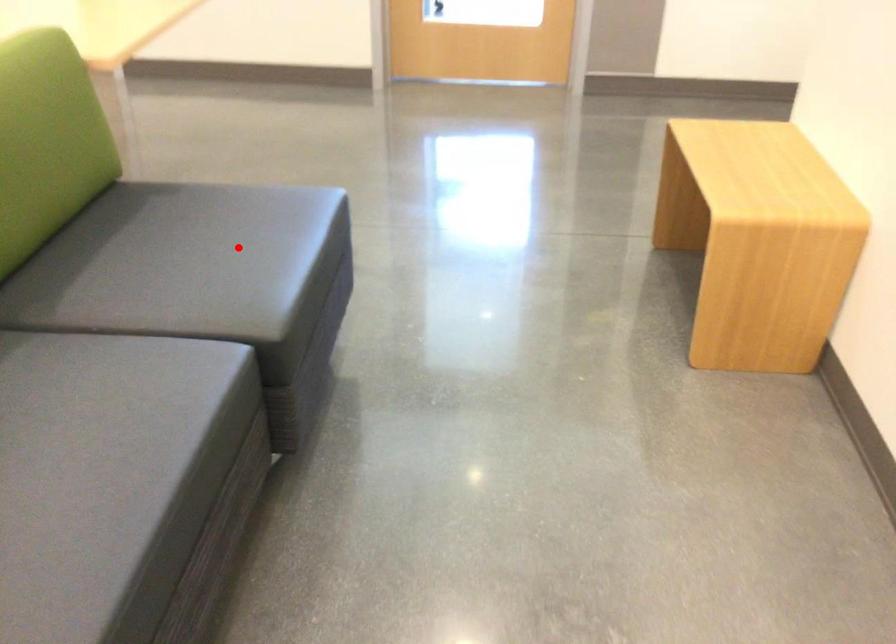
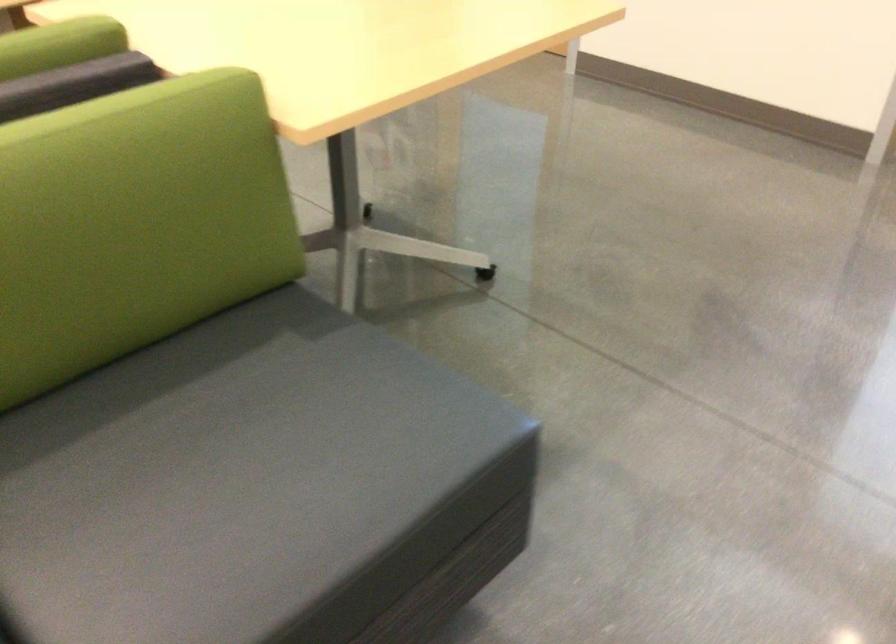
Find the pixel in the second image that matches the highlighted location in the first image.

(259, 488)